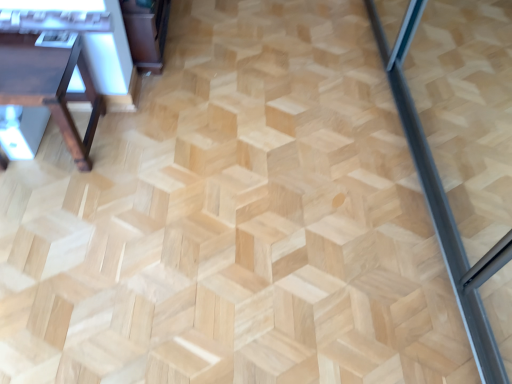
What do you see at coordinates (49, 81) in the screenshot?
I see `dark brown wood table at left` at bounding box center [49, 81].

At what (x,y) coordinates should I click in order to perform the action: click on dark brown wood table at left. Please return your answer as a coordinate pair (x, y). The width and height of the screenshot is (512, 384). Looking at the image, I should click on (49, 81).

Locate an element on the screen. The width and height of the screenshot is (512, 384). dark brown wood table at left is located at coordinates (49, 81).